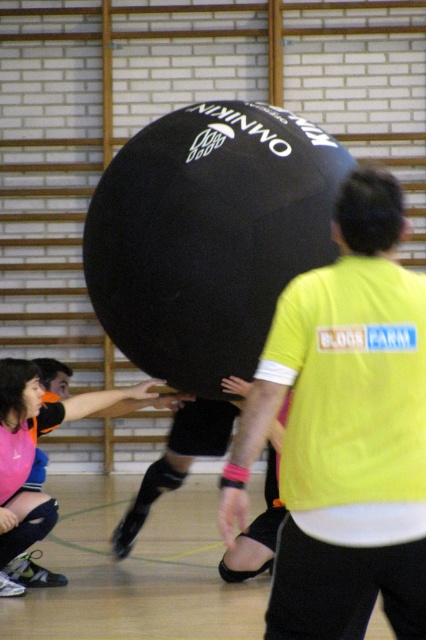
You are observing a sports game and notice two pieces of clothing in the scene. The first is a yellow fabric shirt at center, and the second is matte pink shorts at lower left. Which clothing item appears taller in the image?

The yellow fabric shirt at center is much taller than the matte pink shorts at lower left.

You are an athlete preparing to participate in a game involving the large inflatable ball. You need to ensure your clothing meets the safety requirements. The rules state that the shirt must be wider than the shorts. Based on the scene, does the yellow fabric shirt at center meet the requirement compared to the matte pink shorts at lower left?

The yellow fabric shirt at center has a width less than the matte pink shorts at lower left, so it does not meet the requirement.